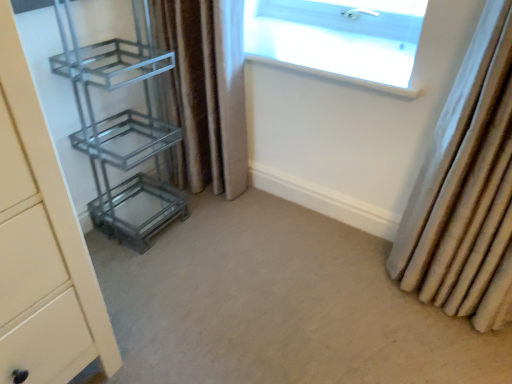
Locate an element on the screen. This screenshot has width=512, height=384. vacant area that lies between beige fabric curtain at right, marked as the second curtain in a left-to-right arrangement, and metallic glass shelf at left is located at coordinates (300, 255).